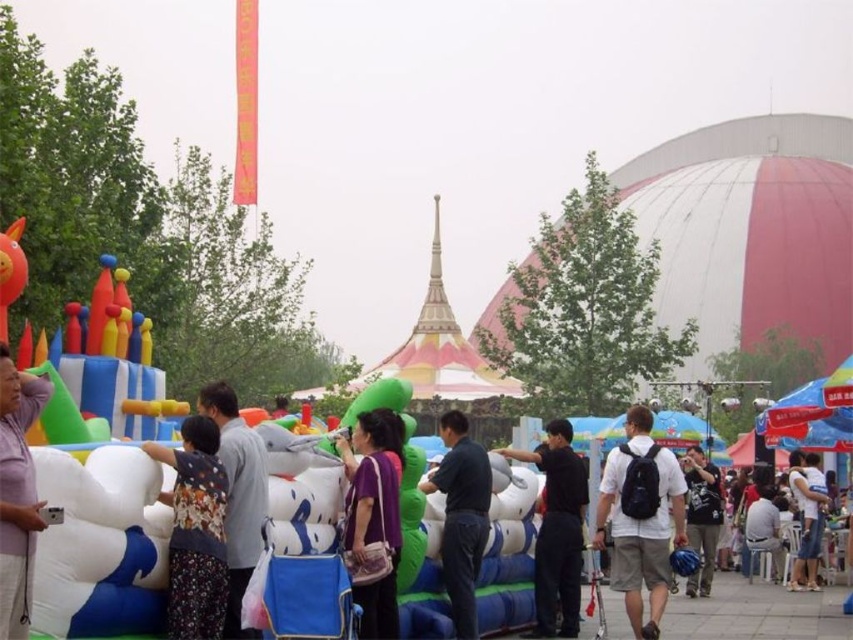
You are at the fair and see a pink matte shirt at left and a black matte shirt at center. Which shirt is positioned more to the left?

The pink matte shirt at left is positioned more to the left than the black matte shirt at center.